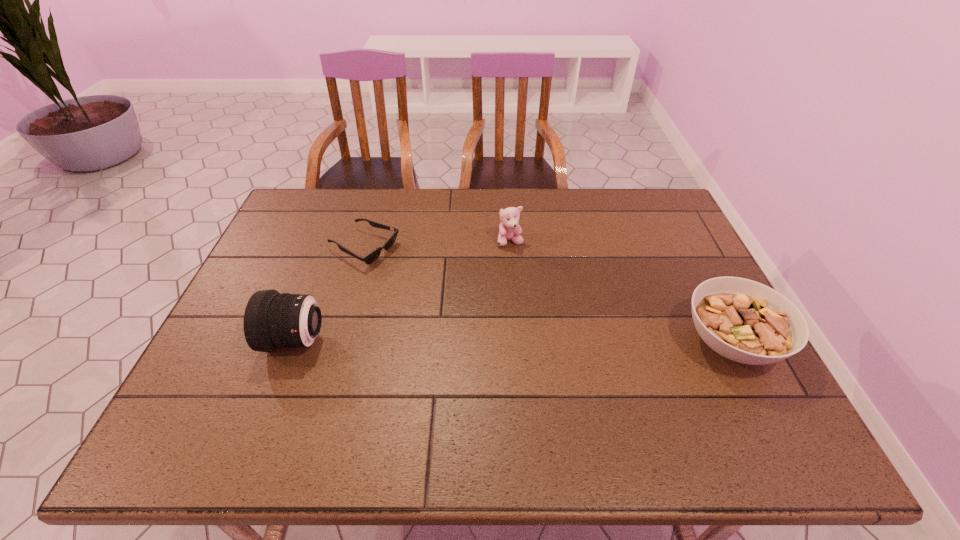
Where is `vacant space at the near right corner`? Image resolution: width=960 pixels, height=540 pixels. vacant space at the near right corner is located at coordinates (755, 408).

The height and width of the screenshot is (540, 960). Identify the location of empty space between the shortest object and the teddy bear. (437, 245).

Where is `free area in between the teddy bear and the sunglasses`? The height and width of the screenshot is (540, 960). free area in between the teddy bear and the sunglasses is located at coordinates (437, 245).

Identify the location of unoccupied area between the third object from left to right and the telephoto lens. (403, 291).

Image resolution: width=960 pixels, height=540 pixels. Find the location of `free space between the second object from right to left and the rightmost object`. free space between the second object from right to left and the rightmost object is located at coordinates (620, 292).

Image resolution: width=960 pixels, height=540 pixels. I want to click on free space between the stew and the telephoto lens, so click(514, 342).

Locate an element on the screen. The image size is (960, 540). vacant space that's between the telephoto lens and the rightmost object is located at coordinates [x=514, y=342].

I want to click on vacant area that lies between the rightmost object and the teddy bear, so click(x=620, y=292).

Locate an element on the screen. The height and width of the screenshot is (540, 960). free space between the tallest object and the stew is located at coordinates (514, 342).

I want to click on empty location between the tallest object and the stew, so click(514, 342).